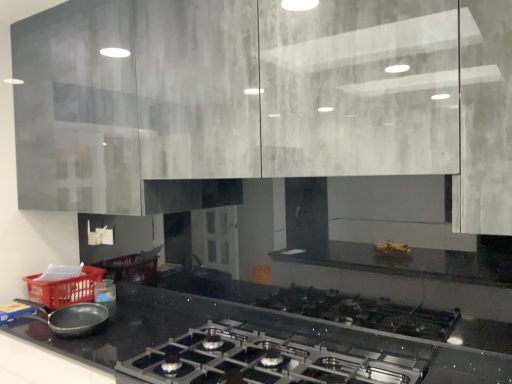
Locate an element on the screen. red plastic basket at lower left is located at coordinates (65, 288).

Measure the distance between red plastic basket at lower left and camera.

The distance of red plastic basket at lower left from camera is 2.11 meters.

Where is `matte black frying pan at lower left`? This screenshot has height=384, width=512. matte black frying pan at lower left is located at coordinates (71, 318).

Find the location of a particular element. The height and width of the screenshot is (384, 512). matte gray cabinets at upper center is located at coordinates (301, 87).

Is red plastic basket at lower left shorter than satin black gas stove at lower center?

Yes.

Considering the points (52, 308) and (146, 361), which point is behind, point (52, 308) or point (146, 361)?

The point (52, 308) is farther from the camera.

You are a GUI agent. You are given a task and a screenshot of the screen. Output one action in this format:
    pyautogui.click(x=<x>, y=<y>)
    Task: Click on the basket located behind the satin black gas stove at lower center
    The height and width of the screenshot is (384, 512).
    Given the screenshot: What is the action you would take?
    pyautogui.click(x=65, y=288)

Considering the sizes of objects red plastic basket at lower left and matte gray cabinets at upper center in the image provided, who is smaller, red plastic basket at lower left or matte gray cabinets at upper center?

red plastic basket at lower left.

Does red plastic basket at lower left have a lesser width compared to matte gray cabinets at upper center?

In fact, red plastic basket at lower left might be wider than matte gray cabinets at upper center.

From the picture: How many degrees apart are the facing directions of red plastic basket at lower left and matte gray cabinets at upper center?

The angle between the facing direction of red plastic basket at lower left and the facing direction of matte gray cabinets at upper center is 1.01 degrees.

Choose the correct answer: Is satin black gas stove at lower center inside red plastic basket at lower left or outside it?

The correct answer is: outside.

Which is closer, (191, 368) or (79, 289)?

The point (191, 368) is more forward.

Where is `basket on the left of satin black gas stove at lower center`? The image size is (512, 384). basket on the left of satin black gas stove at lower center is located at coordinates (65, 288).

Does satin black gas stove at lower center come in front of red plastic basket at lower left?

Yes, the depth of satin black gas stove at lower center is less than that of red plastic basket at lower left.

Considering their positions, is satin black gas stove at lower center located in front of or behind matte gray cabinets at upper center?

In the image, satin black gas stove at lower center appears in front of matte gray cabinets at upper center.

Which point is more forward, (394,379) or (32,38)?

Positioned in front is point (394,379).

Who is bigger, satin black gas stove at lower center or matte gray cabinets at upper center?

matte gray cabinets at upper center is bigger.

What's the angular difference between satin black gas stove at lower center and matte gray cabinets at upper center's facing directions?

There is a 1.01-degree angle between the facing directions of satin black gas stove at lower center and matte gray cabinets at upper center.

Is matte gray cabinets at upper center oriented towards red plastic basket at lower left?

No.

Considering the relative sizes of matte gray cabinets at upper center and red plastic basket at lower left in the image provided, is matte gray cabinets at upper center bigger than red plastic basket at lower left?

Yes.

Is matte gray cabinets at upper center wider or thinner than red plastic basket at lower left?

matte gray cabinets at upper center is thinner than red plastic basket at lower left.

Which is in front, matte gray cabinets at upper center or red plastic basket at lower left?

matte gray cabinets at upper center.

Locate an element on the screen. This screenshot has height=384, width=512. cabinetry that is above the satin black gas stove at lower center (from the image's perspective) is located at coordinates (301, 87).

Is matte gray cabinets at upper center positioned before satin black gas stove at lower center?

That is False.

From a real-world perspective, is matte gray cabinets at upper center located higher than satin black gas stove at lower center?

Yes, from a real-world perspective, matte gray cabinets at upper center is over satin black gas stove at lower center

Would you say satin black gas stove at lower center is part of matte gray cabinets at upper center's contents?

No, matte gray cabinets at upper center does not contain satin black gas stove at lower center.

Is matte black frying pan at lower left turned away from red plastic basket at lower left?

No.

Between matte black frying pan at lower left and red plastic basket at lower left, which one appears on the right side from the viewer's perspective?

matte black frying pan at lower left is more to the right.

Between point (42, 318) and point (101, 277), which one is positioned in front?

The point (42, 318) is in front.

Can you tell me how much matte black frying pan at lower left and red plastic basket at lower left differ in facing direction?

matte black frying pan at lower left and red plastic basket at lower left are facing 0.000752 degrees away from each other.

What are the coordinates of `gas stove below the red plastic basket at lower left (from a real-world perspective)` in the screenshot? It's located at (266, 360).

Find the location of a particular element. This screenshot has height=384, width=512. cabinetry above the red plastic basket at lower left (from a real-world perspective) is located at coordinates (301, 87).

Estimate the real-world distances between objects in this image. Which object is closer to matte black frying pan at lower left, red plastic basket at lower left or matte gray cabinets at upper center?

red plastic basket at lower left is closer to matte black frying pan at lower left.

Which object lies nearer to the anchor point matte black frying pan at lower left, red plastic basket at lower left or satin black gas stove at lower center?

red plastic basket at lower left lies closer to matte black frying pan at lower left than the other object.

Estimate the real-world distances between objects in this image. Which object is closer to matte black frying pan at lower left, satin black gas stove at lower center or matte gray cabinets at upper center?

satin black gas stove at lower center.

Which object lies nearer to the anchor point matte gray cabinets at upper center, satin black gas stove at lower center or red plastic basket at lower left?

satin black gas stove at lower center is closer to matte gray cabinets at upper center.

Considering their positions, is satin black gas stove at lower center positioned further to matte black frying pan at lower left than red plastic basket at lower left?

satin black gas stove at lower center is positioned further to the anchor matte black frying pan at lower left.

When comparing their distances from red plastic basket at lower left, does satin black gas stove at lower center or matte gray cabinets at upper center seem closer?

satin black gas stove at lower center is closer to red plastic basket at lower left.

Estimate the real-world distances between objects in this image. Which object is further from red plastic basket at lower left, matte black frying pan at lower left or satin black gas stove at lower center?

satin black gas stove at lower center is further to red plastic basket at lower left.

When comparing their distances from red plastic basket at lower left, does matte gray cabinets at upper center or matte black frying pan at lower left seem further?

matte gray cabinets at upper center.

Image resolution: width=512 pixels, height=384 pixels. I want to click on kitchen appliance between satin black gas stove at lower center and red plastic basket at lower left from front to back, so click(x=71, y=318).

Find the location of a particular element. Image resolution: width=512 pixels, height=384 pixels. kitchen appliance between matte gray cabinets at upper center and satin black gas stove at lower center vertically is located at coordinates (71, 318).

Locate an element on the screen. This screenshot has height=384, width=512. cabinetry positioned between satin black gas stove at lower center and red plastic basket at lower left from near to far is located at coordinates (301, 87).

Find the location of a particular element. This screenshot has width=512, height=384. kitchen appliance between matte gray cabinets at upper center and red plastic basket at lower left in the front-back direction is located at coordinates (71, 318).